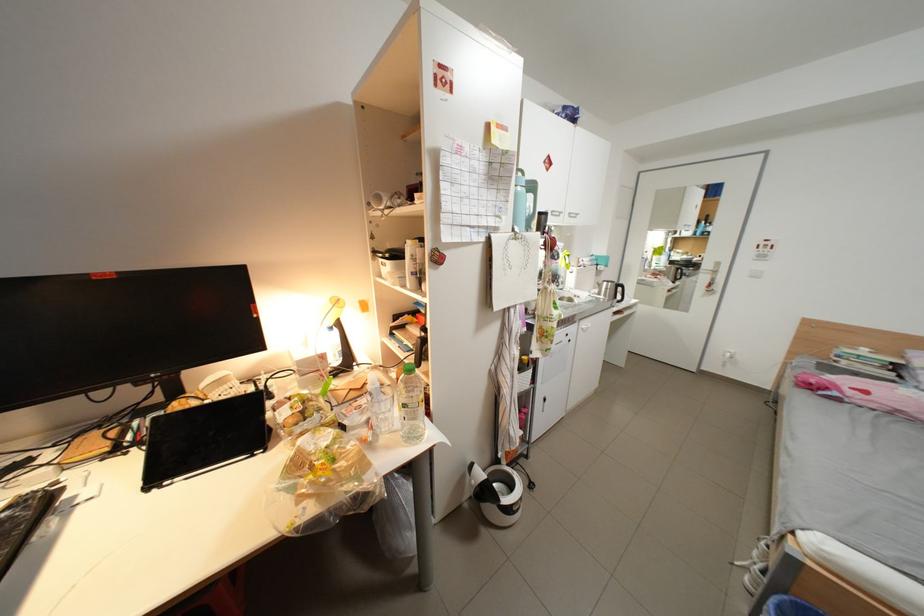
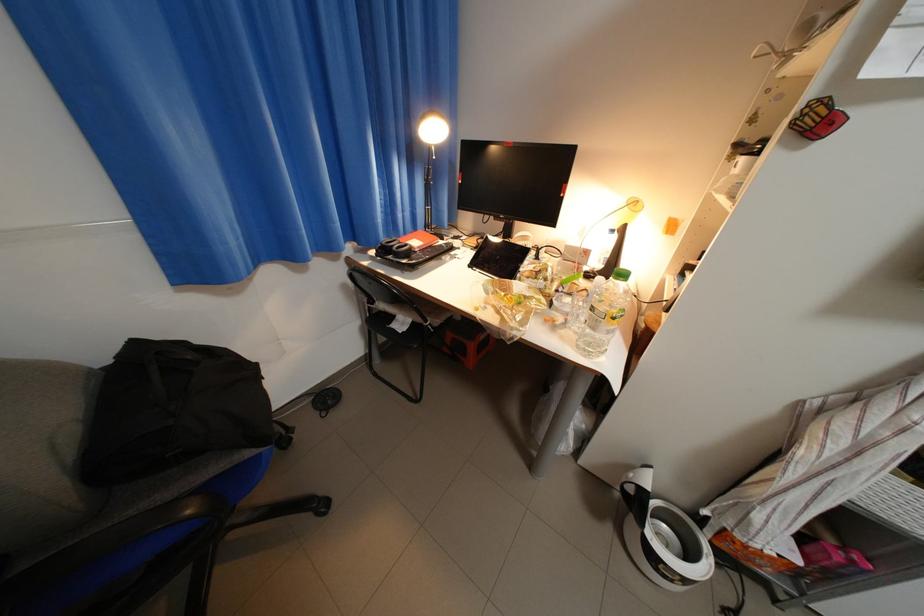
Where in the second image is the point corresponding to the point at 126,435 from the first image?

(492, 241)